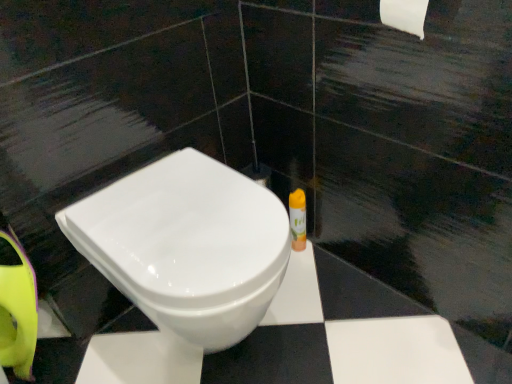
Question: Could white glossy toilet at center be considered to be inside yellow plastic spray can at right?

Choices:
 (A) yes
 (B) no

Answer: (B)

Question: From the image's perspective, does yellow plastic spray can at right appear higher than white glossy toilet at center?

Choices:
 (A) no
 (B) yes

Answer: (B)

Question: Can you confirm if yellow plastic spray can at right is shorter than white glossy toilet at center?

Choices:
 (A) yes
 (B) no

Answer: (A)

Question: Is the depth of yellow plastic spray can at right greater than that of white glossy toilet at center?

Choices:
 (A) no
 (B) yes

Answer: (B)

Question: Is yellow plastic spray can at right positioned in front of white glossy toilet at center?

Choices:
 (A) yes
 (B) no

Answer: (B)

Question: Does yellow plastic spray can at right have a lesser width compared to white glossy toilet at center?

Choices:
 (A) no
 (B) yes

Answer: (B)

Question: From a real-world perspective, is white glossy toilet at center under yellow plastic spray can at right?

Choices:
 (A) no
 (B) yes

Answer: (A)

Question: Does white glossy toilet at center have a greater width compared to yellow plastic spray can at right?

Choices:
 (A) no
 (B) yes

Answer: (B)

Question: From the image's perspective, does white glossy toilet at center appear lower than yellow plastic spray can at right?

Choices:
 (A) yes
 (B) no

Answer: (A)

Question: From a real-world perspective, does white glossy toilet at center stand above yellow plastic spray can at right?

Choices:
 (A) no
 (B) yes

Answer: (B)

Question: Is white glossy toilet at center thinner than yellow plastic spray can at right?

Choices:
 (A) no
 (B) yes

Answer: (A)

Question: Is white glossy toilet at center at the left side of yellow plastic spray can at right?

Choices:
 (A) yes
 (B) no

Answer: (A)

Question: In terms of width, does white glossy toilet at center look wider or thinner when compared to yellow plastic spray can at right?

Choices:
 (A) thin
 (B) wide

Answer: (B)